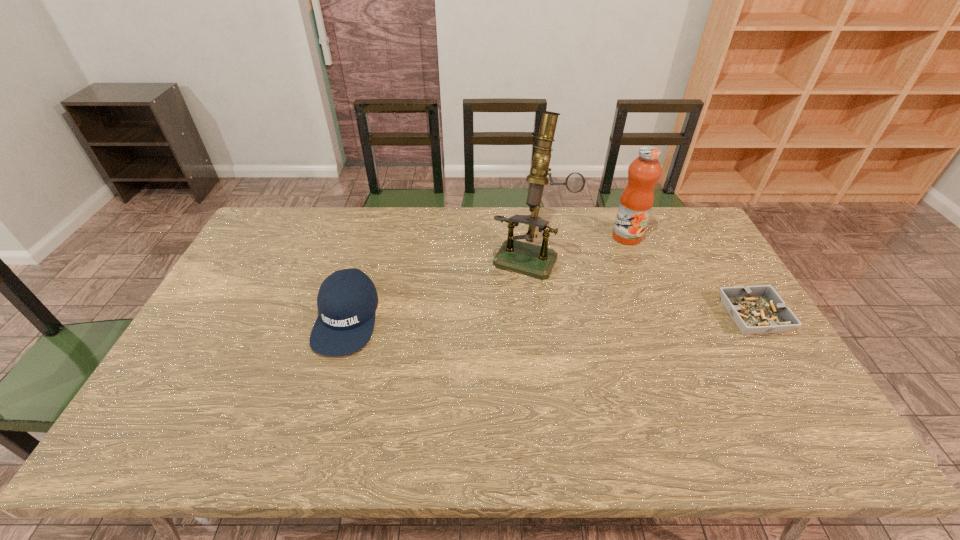
This screenshot has height=540, width=960. In order to click on vacant space at the near edge in this screenshot , I will do `click(276, 389)`.

You are a GUI agent. You are given a task and a screenshot of the screen. Output one action in this format:
    pyautogui.click(x=<x>, y=<y>)
    Task: Click on the vacant area at the left edge
    Image resolution: width=960 pixels, height=540 pixels.
    Given the screenshot: What is the action you would take?
    pyautogui.click(x=231, y=323)

In the image, there is a desktop. Identify the location of free space at the right edge. This screenshot has height=540, width=960. (739, 367).

I want to click on vacant space at the far left corner, so click(297, 228).

Locate an element on the screen. Image resolution: width=960 pixels, height=540 pixels. free region at the far right corner of the desktop is located at coordinates (668, 246).

This screenshot has height=540, width=960. Identify the location of vacant area that lies between the third tallest object and the fruit juice. (487, 277).

This screenshot has width=960, height=540. Identify the location of vacant region between the rightmost object and the tallest object. pos(641,286).

Where is `vacant region between the leftmost object and the third object from left to right`? The image size is (960, 540). vacant region between the leftmost object and the third object from left to right is located at coordinates (487, 277).

Image resolution: width=960 pixels, height=540 pixels. Identify the location of free spot between the rightmost object and the second shortest object. (550, 317).

What are the coordinates of `empty location between the baseball cap and the ashtray` in the screenshot? It's located at (550, 317).